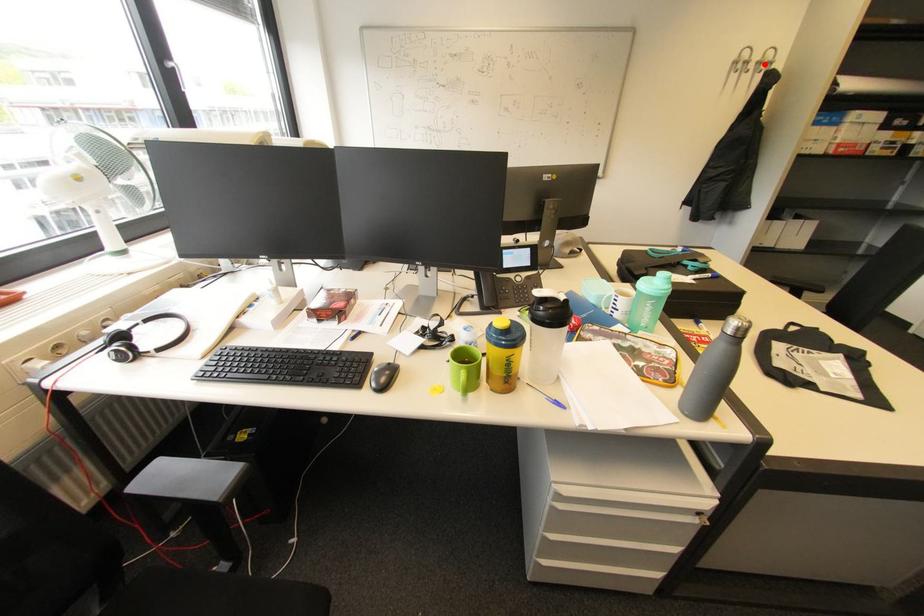
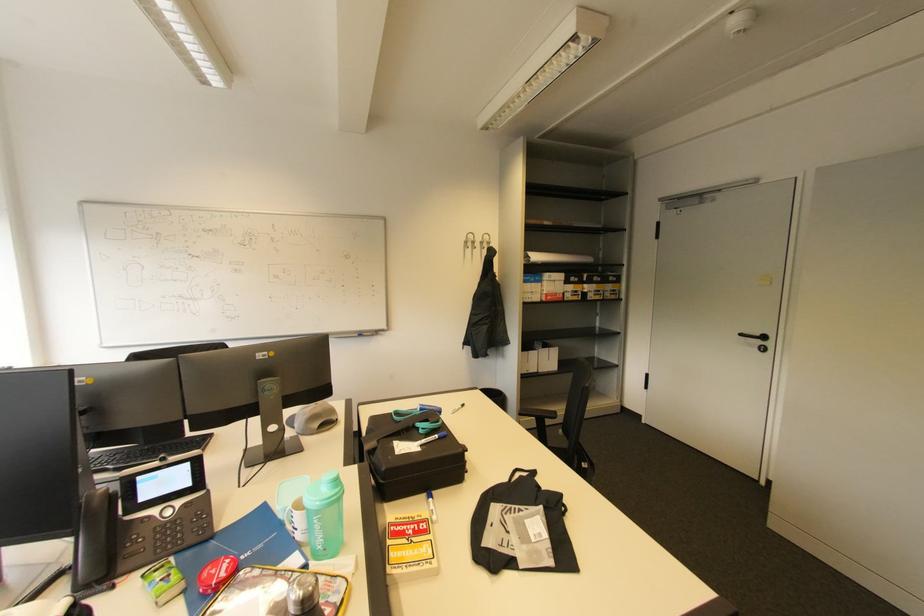
Question: I am providing you with two images of the same scene from different viewpoints. A red point is marked on the first image. At the location where the point appears in image 1, is it still visible in image 2?

Choices:
 (A) Yes
 (B) No

Answer: (A)